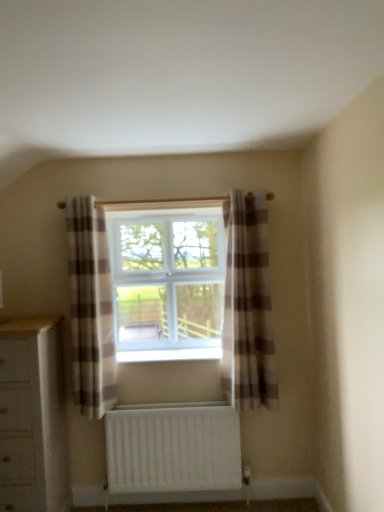
Question: Do you think plaid fabric curtain at center, arranged as the second curtain when viewed from the left, is within white plastic window at center, or outside of it?

Choices:
 (A) outside
 (B) inside

Answer: (A)

Question: Does point (240, 379) appear closer or farther from the camera than point (162, 339)?

Choices:
 (A) closer
 (B) farther

Answer: (A)

Question: Which object is the closest to the white wood chest of drawers at lower left?

Choices:
 (A) plaid fabric curtain at center, arranged as the second curtain when viewed from the left
 (B) white matte radiator at lower center
 (C) white plastic window sill at center
 (D) plaid fabric curtain at center, marked as the 1th curtain in a left-to-right arrangement
 (E) white plastic window at center

Answer: (D)

Question: Which object is positioned farthest from the white matte radiator at lower center?

Choices:
 (A) plaid fabric curtain at center, marked as the 1th curtain in a left-to-right arrangement
 (B) white plastic window at center
 (C) plaid fabric curtain at center, which is the first curtain from right to left
 (D) white plastic window sill at center
 (E) white wood chest of drawers at lower left

Answer: (B)